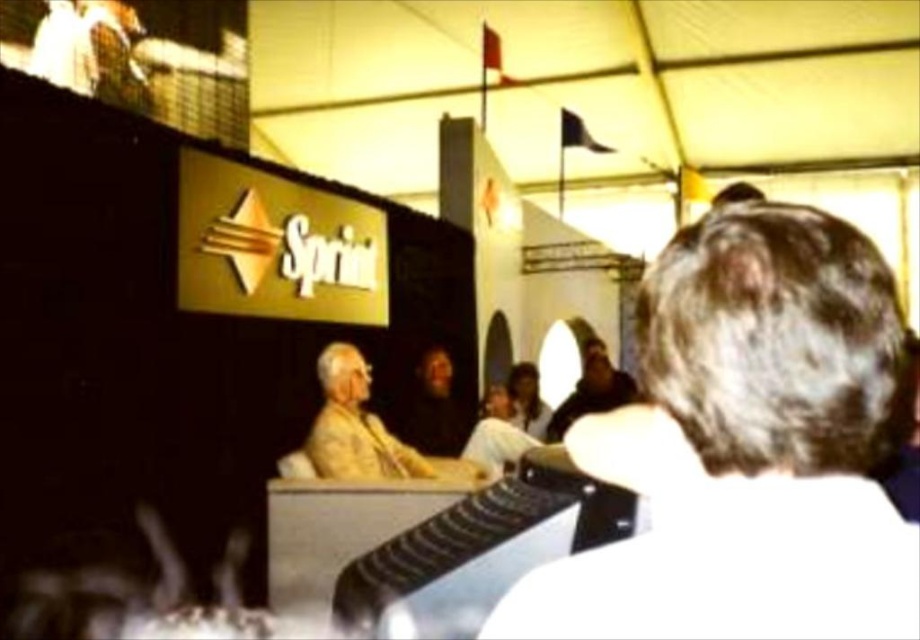
Which is behind, point (408, 477) or point (596, 380)?

Point (596, 380)

Can you confirm if yellow fabric at center is smaller than dark brown leather jacket at center?

Yes.

You are a GUI agent. You are given a task and a screenshot of the screen. Output one action in this format:
    pyautogui.click(x=<x>, y=<y>)
    Task: Click on the yellow fabric at center
    Image resolution: width=920 pixels, height=640 pixels.
    Given the screenshot: What is the action you would take?
    pyautogui.click(x=366, y=429)

Which of these two, white matte hair at upper right or dark brown leather jacket at center, stands taller?

With more height is dark brown leather jacket at center.

Between point (581, 592) and point (587, 365), which one is positioned in front?

Point (581, 592)

The height and width of the screenshot is (640, 920). In order to click on white matte hair at upper right in this screenshot , I will do `click(748, 448)`.

Does point (808, 451) lie in front of point (331, 422)?

Yes, it is in front of point (331, 422).

Is point (806, 460) more distant than point (353, 356)?

No, (806, 460) is in front of (353, 356).

Find the location of a particular element. white matte hair at upper right is located at coordinates (748, 448).